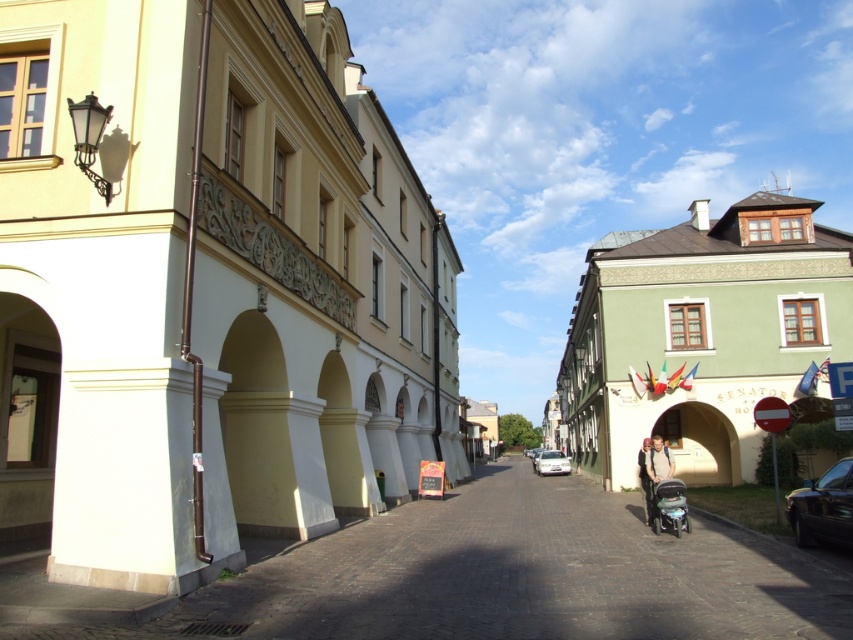
Measure the distance between point (653, 433) and camera.

Point (653, 433) is 91.65 feet away from camera.

Based on the photo, can you confirm if beige stone archway at center is shorter than white glossy car at center?

Indeed, beige stone archway at center has a lesser height compared to white glossy car at center.

Who is more distant from viewer, (669,435) or (550,449)?

Point (550,449)

I want to click on beige stone archway at center, so click(700, 444).

Who is shorter, shiny black car at right or metallic silver motorcycle at lower right?

metallic silver motorcycle at lower right is shorter.

Does shiny black car at right have a smaller size compared to metallic silver motorcycle at lower right?

No, shiny black car at right is not smaller than metallic silver motorcycle at lower right.

Identify the location of shiny black car at right. The image size is (853, 640). (822, 506).

Is shiny black car at right to the left of white glossy car at center from the viewer's perspective?

Yes, shiny black car at right is to the left of white glossy car at center.

Is point (824, 513) less distant than point (543, 452)?

Yes.

Locate an element on the screen. Image resolution: width=853 pixels, height=640 pixels. shiny black car at right is located at coordinates (822, 506).